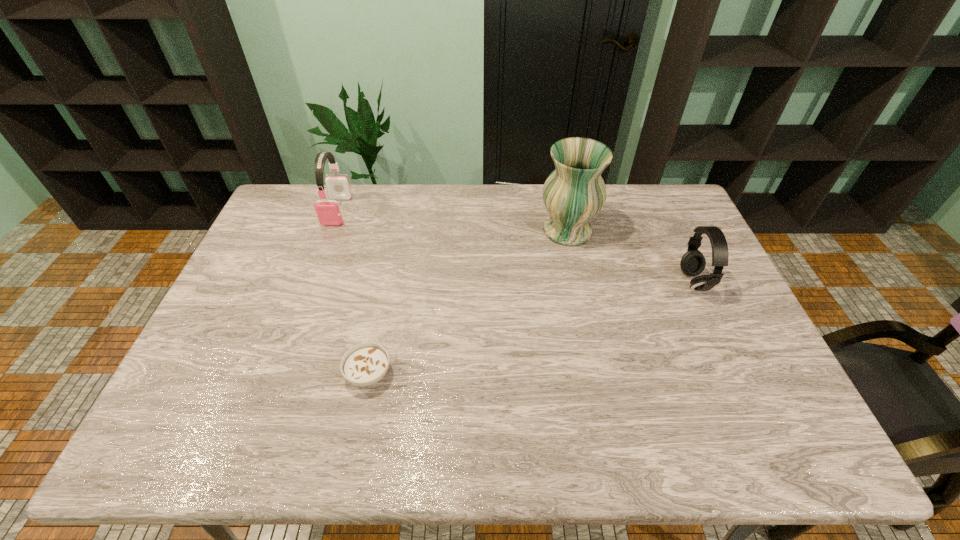
Identify the location of free space at the right edge. This screenshot has height=540, width=960. (740, 312).

The height and width of the screenshot is (540, 960). In order to click on vacant space at the far left corner of the desktop in this screenshot , I will do `click(300, 198)`.

The width and height of the screenshot is (960, 540). I want to click on free spot at the far right corner of the desktop, so click(644, 202).

Find the location of a particular element. This screenshot has height=540, width=960. free area in between the left earphone and the rightmost object is located at coordinates (516, 246).

Find the location of `unoccupied position between the farther earphone and the third object from left to right`. unoccupied position between the farther earphone and the third object from left to right is located at coordinates (452, 220).

Where is `vacant area between the second object from right to left and the third farthest object`? vacant area between the second object from right to left and the third farthest object is located at coordinates (631, 256).

At what (x,y) coordinates should I click in order to perform the action: click on vacant area between the tallest object and the leftmost object. Please return your answer as a coordinate pair (x, y). Image resolution: width=960 pixels, height=540 pixels. Looking at the image, I should click on 452,220.

Where is `free spot between the shortest object and the vase`? free spot between the shortest object and the vase is located at coordinates [x=468, y=302].

The image size is (960, 540). In order to click on free space between the nearest object and the rightmost object in this screenshot , I will do `click(531, 328)`.

The width and height of the screenshot is (960, 540). Find the location of `vacant space in between the leftmost object and the nearest object`. vacant space in between the leftmost object and the nearest object is located at coordinates (353, 292).